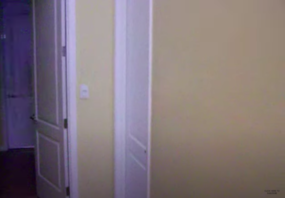
Where is `door knob`? Image resolution: width=285 pixels, height=198 pixels. door knob is located at coordinates (9, 96), (33, 116).